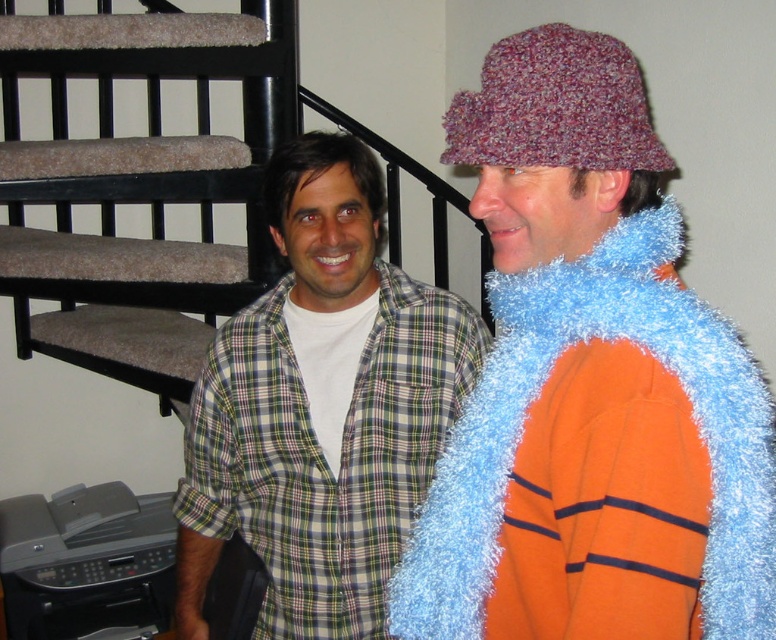
Question: Can you confirm if multicolored knitted hat at upper right is wider than black plastic printer at lower left?

Choices:
 (A) yes
 (B) no

Answer: (B)

Question: Where is black metal balustrade at left located in relation to black plastic printer at lower left in the image?

Choices:
 (A) left
 (B) right

Answer: (B)

Question: Considering the relative positions of black metal balustrade at left and multicolored knitted hat at upper right in the image provided, where is black metal balustrade at left located with respect to multicolored knitted hat at upper right?

Choices:
 (A) right
 (B) left

Answer: (B)

Question: Which of the following is the closest to the observer?

Choices:
 (A) black plastic printer at lower left
 (B) plaid shirt at center

Answer: (B)

Question: Estimate the real-world distances between objects in this image. Which object is farther from the black plastic printer at lower left?

Choices:
 (A) fluffy blue scarf at right
 (B) plaid shirt at center
 (C) multicolored knitted hat at upper right

Answer: (C)

Question: Among these points, which one is farthest from the camera?

Choices:
 (A) (303, 397)
 (B) (539, 552)

Answer: (A)